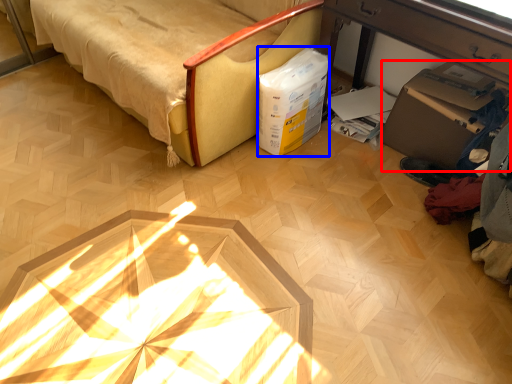
Question: Among these objects, which one is farthest to the camera, cardboard box (highlighted by a red box) or box (highlighted by a blue box)?

Choices:
 (A) cardboard box
 (B) box

Answer: (B)